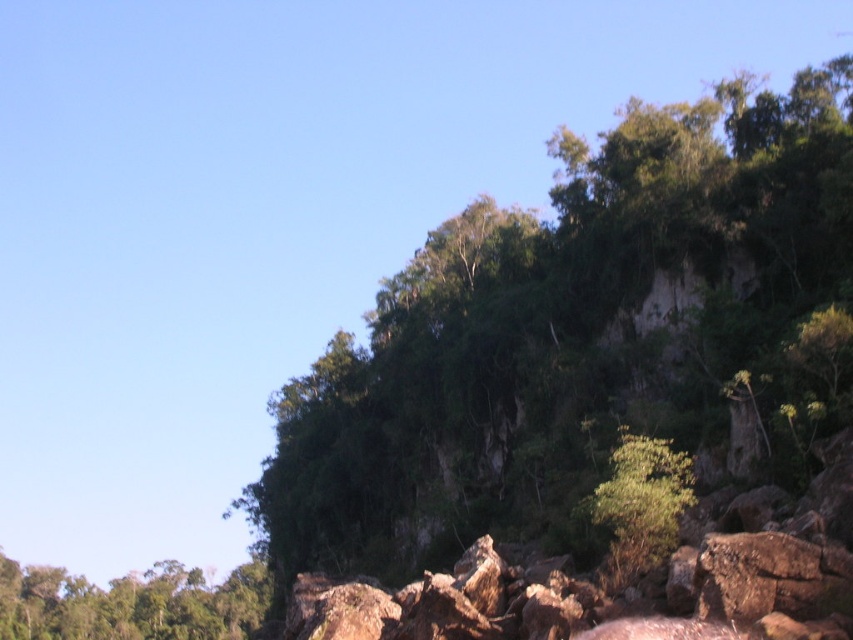
Describe the element at coordinates (131, 604) in the screenshot. I see `green leafy tree at lower left` at that location.

Does green leafy tree at lower left have a lesser width compared to green leafy tree at center?

No.

Looking at this image, measure the distance between green leafy tree at lower left and camera.

green leafy tree at lower left is 620.30 feet from camera.

Locate an element on the screen. green leafy tree at lower left is located at coordinates (131, 604).

Is green leafy tree at upper center smaller than green leafy tree at center?

No, green leafy tree at upper center is not smaller than green leafy tree at center.

Which is in front, point (581, 540) or point (686, 497)?

Point (686, 497) is more forward.

Who is more distant from viewer, (294, 522) or (631, 531)?

The point (294, 522) is more distant.

Where is `green leafy tree at upper center`? green leafy tree at upper center is located at coordinates (572, 337).

Can you confirm if green leafy tree at upper center is shorter than green leafy tree at lower left?

A: In fact, green leafy tree at upper center may be taller than green leafy tree at lower left.

Is green leafy tree at upper center below green leafy tree at lower left?

Actually, green leafy tree at upper center is above green leafy tree at lower left.

Between point (764, 371) and point (256, 596), which one is positioned behind?

The point (256, 596) is more distant.

Where is `green leafy tree at upper center`? The width and height of the screenshot is (853, 640). green leafy tree at upper center is located at coordinates (572, 337).